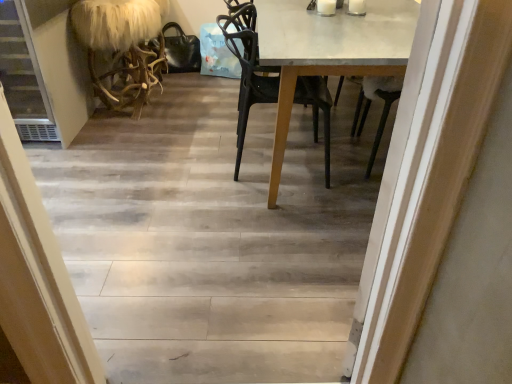
Question: From the image's perspective, is wooden floor at center on top of fuzzy white fur at left?

Choices:
 (A) yes
 (B) no

Answer: (B)

Question: Does wooden floor at center have a greater height compared to fuzzy white fur at left?

Choices:
 (A) no
 (B) yes

Answer: (A)

Question: Can we say wooden floor at center lies outside fuzzy white fur at left?

Choices:
 (A) yes
 (B) no

Answer: (A)

Question: From a real-world perspective, is wooden floor at center located higher than fuzzy white fur at left?

Choices:
 (A) yes
 (B) no

Answer: (B)

Question: Is wooden floor at center positioned behind fuzzy white fur at left?

Choices:
 (A) no
 (B) yes

Answer: (A)

Question: Is white glossy table at center wider or thinner than fuzzy white fur at left?

Choices:
 (A) thin
 (B) wide

Answer: (B)

Question: Would you say white glossy table at center is inside or outside fuzzy white fur at left?

Choices:
 (A) inside
 (B) outside

Answer: (B)

Question: From the image's perspective, relative to fuzzy white fur at left, is white glossy table at center above or below?

Choices:
 (A) below
 (B) above

Answer: (A)

Question: In terms of height, does white glossy table at center look taller or shorter compared to fuzzy white fur at left?

Choices:
 (A) tall
 (B) short

Answer: (A)

Question: Choose the correct answer: Is wooden floor at center inside fuzzy white fur at left or outside it?

Choices:
 (A) outside
 (B) inside

Answer: (A)

Question: Based on their sizes in the image, would you say wooden floor at center is bigger or smaller than fuzzy white fur at left?

Choices:
 (A) small
 (B) big

Answer: (B)

Question: From a real-world perspective, is wooden floor at center above or below fuzzy white fur at left?

Choices:
 (A) above
 (B) below

Answer: (B)

Question: In terms of height, does wooden floor at center look taller or shorter compared to fuzzy white fur at left?

Choices:
 (A) short
 (B) tall

Answer: (A)

Question: Considering the positions of point (293, 54) and point (320, 99), is point (293, 54) closer or farther from the camera than point (320, 99)?

Choices:
 (A) farther
 (B) closer

Answer: (B)

Question: Is white glossy table at center bigger or smaller than black matte chair at center?

Choices:
 (A) big
 (B) small

Answer: (A)